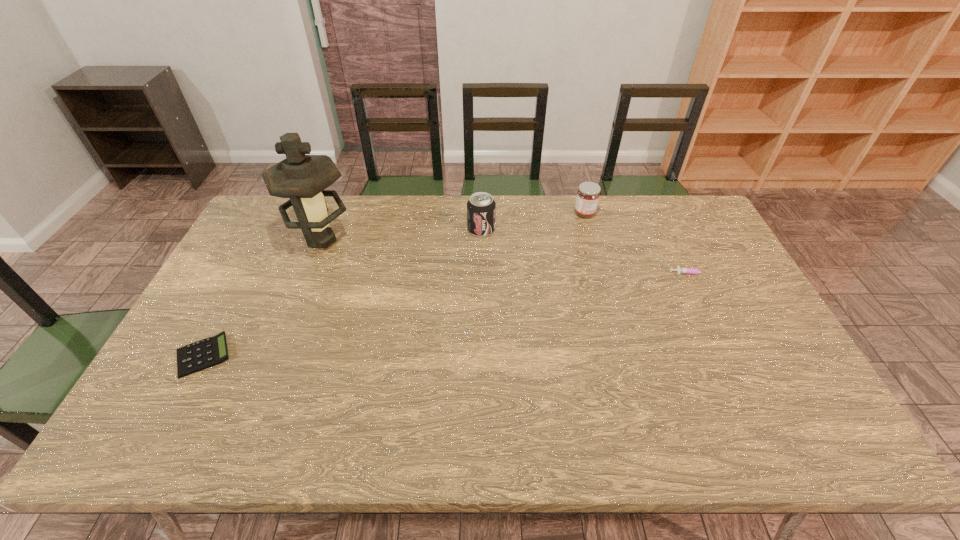
This screenshot has height=540, width=960. Find the location of `vacant space located 0.370m on the front of the farthest object`. vacant space located 0.370m on the front of the farthest object is located at coordinates (608, 298).

Locate an element on the screen. Image resolution: width=960 pixels, height=540 pixels. vacant region located 0.110m on the back of the rightmost object is located at coordinates (679, 246).

Identify the location of vacant space located 0.320m on the right of the calculator. This screenshot has height=540, width=960. (355, 355).

Locate an element on the screen. oil lamp situated at the far edge is located at coordinates (303, 178).

This screenshot has width=960, height=540. Find the location of `soda can situated at the far edge`. soda can situated at the far edge is located at coordinates (481, 208).

The width and height of the screenshot is (960, 540). I want to click on jam at the far edge, so click(x=588, y=194).

Identify the location of oil lamp present at the left edge. (303, 178).

The height and width of the screenshot is (540, 960). In order to click on calculator that is at the left edge in this screenshot , I will do `click(209, 352)`.

Identify the location of object positioned at the right edge. Image resolution: width=960 pixels, height=540 pixels. (682, 270).

Find the location of `object located at the far left corner`. object located at the far left corner is located at coordinates (303, 178).